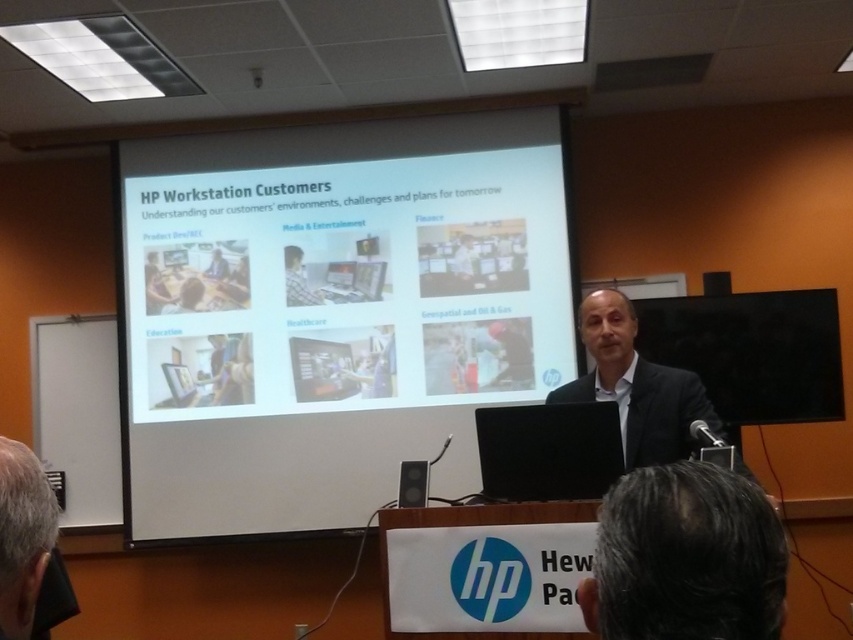
Question: Is white matte projector screen at upper center thinner than matte black laptop at center?

Choices:
 (A) yes
 (B) no

Answer: (B)

Question: Does matte black laptop at center come behind matte black speaker at center?

Choices:
 (A) yes
 (B) no

Answer: (A)

Question: Among these points, which one is nearest to the camera?

Choices:
 (A) (9, 490)
 (B) (415, 464)
 (C) (155, 480)

Answer: (A)

Question: Is gray hair at lower left to the right of matte black speaker at center from the viewer's perspective?

Choices:
 (A) no
 (B) yes

Answer: (A)

Question: Which point is closer to the camera?

Choices:
 (A) matte black laptop at center
 (B) dark brown hair at lower center
 (C) gray hair at lower left
 (D) black smooth suit at center

Answer: (B)

Question: Which of the following is the farthest from the observer?

Choices:
 (A) (764, 508)
 (B) (677, 410)
 (C) (294, 253)

Answer: (C)